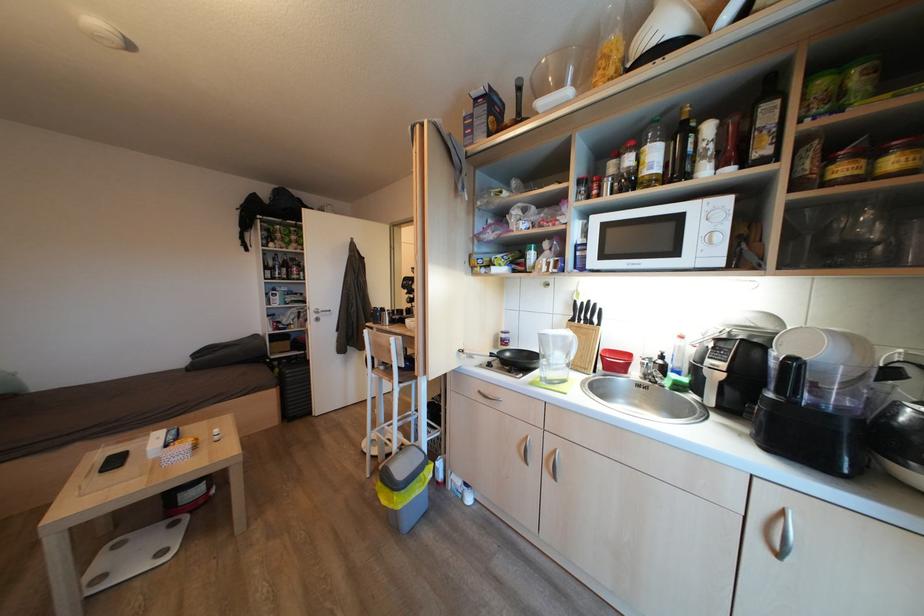
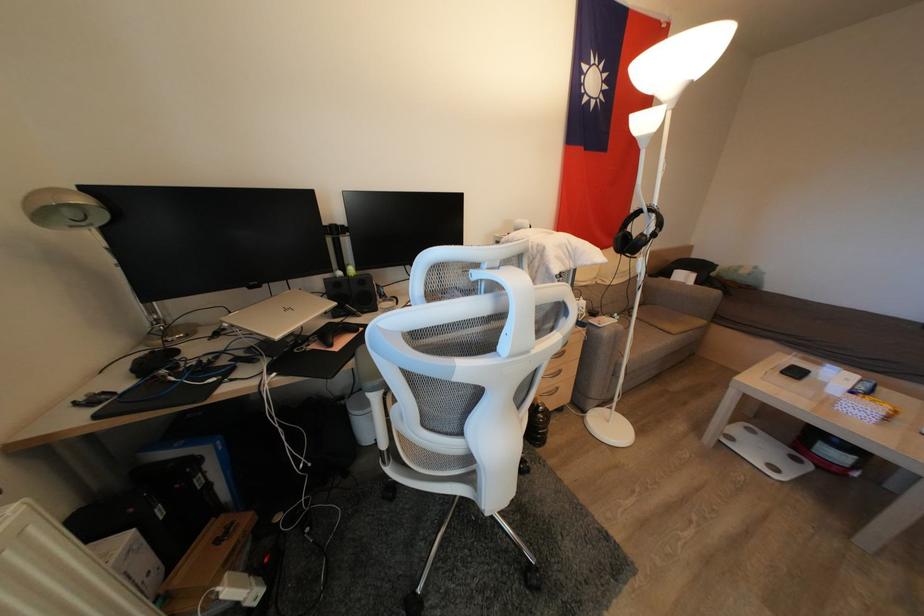
The first image is from the beginning of the video and the second image is from the end. How did the camera likely rotate when shooting the video?

The rotation direction of the camera is left-down.